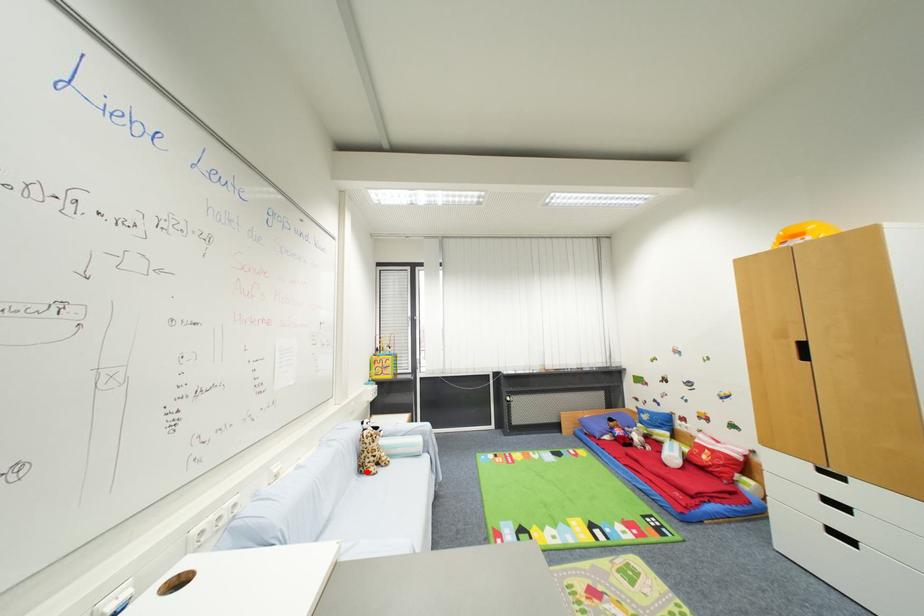
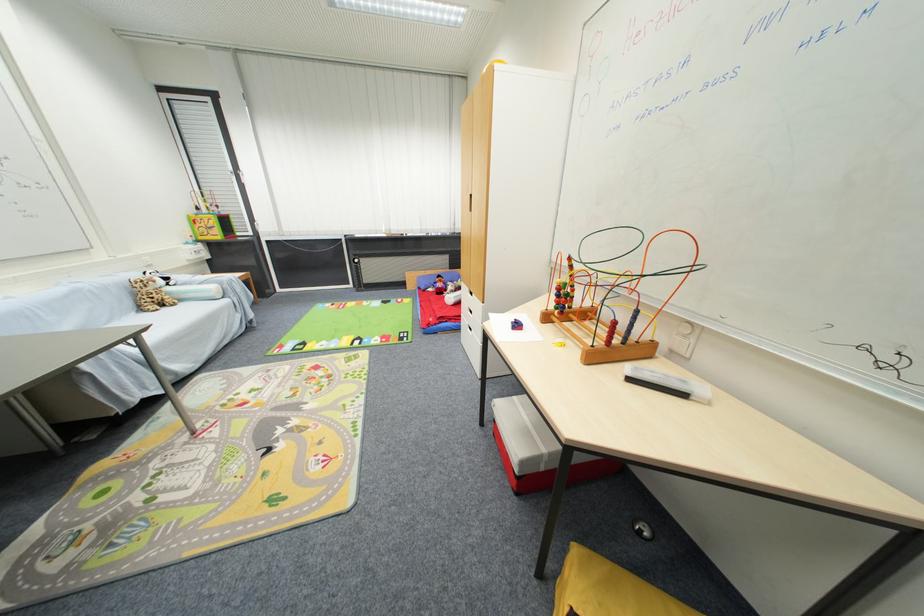
Question: I am providing you with two images of the same scene from different viewpoints. Given a red point in image1, look at the same physical point in image2. Is it:

Choices:
 (A) Closer to the viewpoint
 (B) Farther from the viewpoint

Answer: (A)